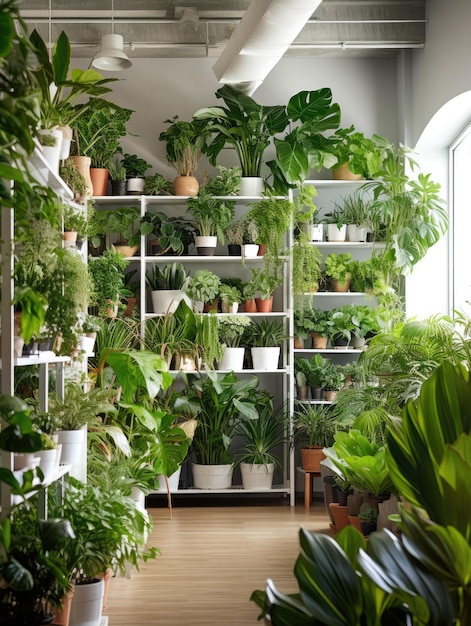
Locate an element on the screen. The image size is (471, 626). brown hardwood floor is located at coordinates click(237, 563).